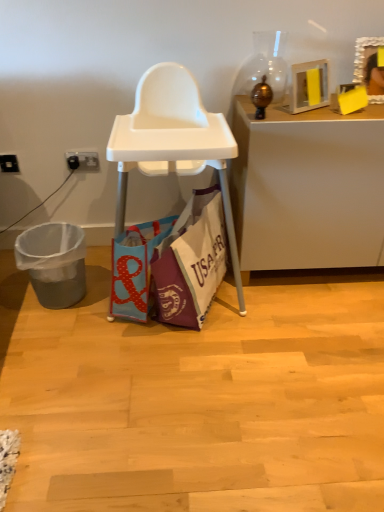
Question: Is white plastic power outlet at lower left, the second power outlet when ordered from left to right, positioned with its back to gray plastic trash can at lower left?

Choices:
 (A) no
 (B) yes

Answer: (A)

Question: Is white plastic power outlet at lower left, the second power outlet when ordered from left to right, to the left of gray plastic trash can at lower left from the viewer's perspective?

Choices:
 (A) yes
 (B) no

Answer: (B)

Question: Is white plastic power outlet at lower left, the second power outlet when ordered from left to right, thinner than gray plastic trash can at lower left?

Choices:
 (A) yes
 (B) no

Answer: (A)

Question: Can you confirm if white plastic power outlet at lower left, which is counted as the first power outlet, starting from the right, is taller than gray plastic trash can at lower left?

Choices:
 (A) no
 (B) yes

Answer: (A)

Question: Considering the relative sizes of white plastic power outlet at lower left, the second power outlet when ordered from left to right, and gray plastic trash can at lower left in the image provided, is white plastic power outlet at lower left, the second power outlet when ordered from left to right, wider than gray plastic trash can at lower left?

Choices:
 (A) no
 (B) yes

Answer: (A)

Question: Can you confirm if white plastic power outlet at lower left, which is counted as the first power outlet, starting from the right, is bigger than gray plastic trash can at lower left?

Choices:
 (A) no
 (B) yes

Answer: (A)

Question: Is white plastic high chair at center not within white glossy desk at upper right?

Choices:
 (A) no
 (B) yes

Answer: (B)

Question: Can you confirm if white plastic high chair at center is smaller than white glossy desk at upper right?

Choices:
 (A) yes
 (B) no

Answer: (B)

Question: Is white plastic high chair at center positioned far away from white glossy desk at upper right?

Choices:
 (A) no
 (B) yes

Answer: (A)

Question: Can you confirm if white plastic high chair at center is bigger than white glossy desk at upper right?

Choices:
 (A) yes
 (B) no

Answer: (A)

Question: Is white plastic high chair at center facing towards white glossy desk at upper right?

Choices:
 (A) no
 (B) yes

Answer: (A)

Question: From the image's perspective, is white plastic high chair at center over white glossy desk at upper right?

Choices:
 (A) yes
 (B) no

Answer: (B)

Question: Is wooden picture frame at upper right bigger than white glossy desk at upper right?

Choices:
 (A) yes
 (B) no

Answer: (B)